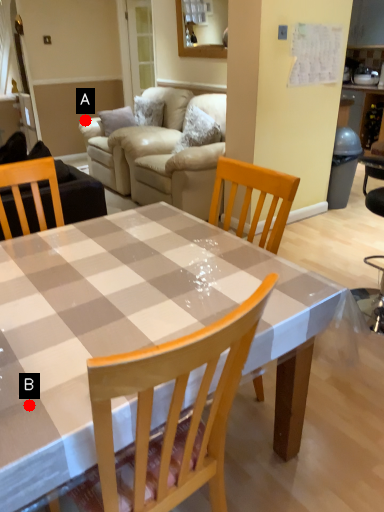
Question: Two points are circled on the image, labeled by A and B beside each circle. Which point is further to the camera?

Choices:
 (A) A is further
 (B) B is further

Answer: (A)